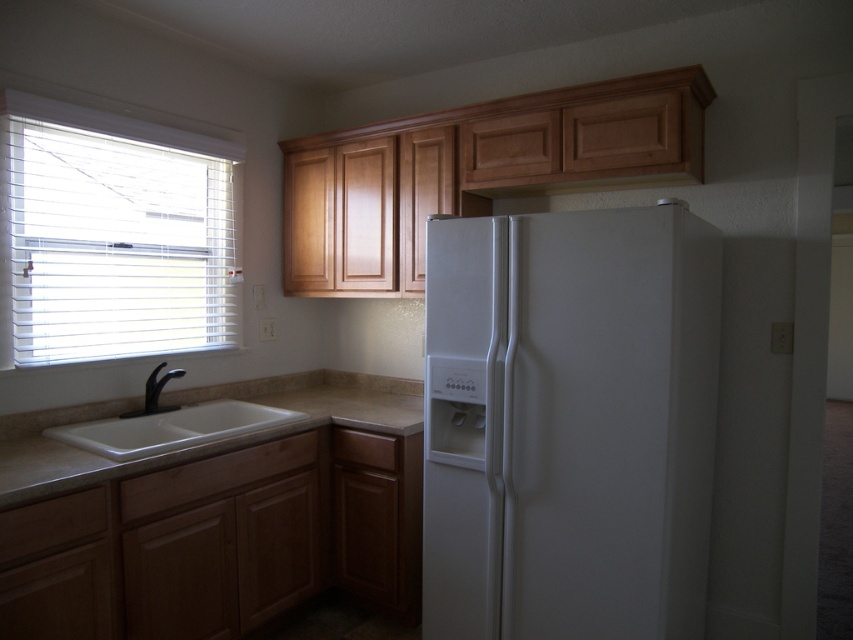
You are standing in the kitchen and want to clean the white blinds at left. To reach them, you need to move the white matte refrigerator at center. Is this necessary?

The white matte refrigerator at center is below the white blinds at left, so you do not need to move the refrigerator to reach the blinds.

You are a delivery person bringing a new microwave to the kitchen. The microwave is 6 feet long. You need to place it between the white matte refrigerator at center and the sink. Is there enough space?

The white matte refrigerator at center and the sink are 6.40 feet apart. Since the microwave is 6 feet long, there is enough space to place it between them.

You are a kitchen designer trying to place a new appliance that is 1.2 meters wide. You see the white matte refrigerator at center and the white ceramic sink at lower left. Which object is wider, and can the appliance fit next to the narrower one?

The white matte refrigerator at center is wider than the white ceramic sink at lower left. Since the appliance is 1.2 meters wide, it can fit next to the narrower white ceramic sink at lower left provided there is sufficient space.